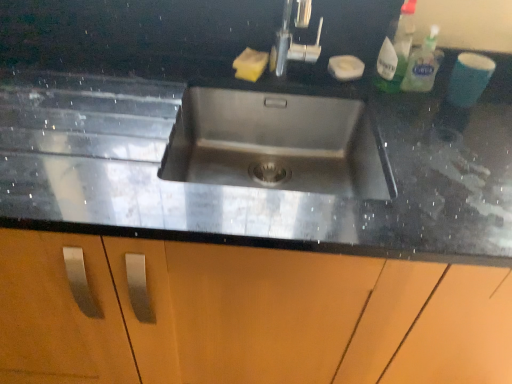
What do you see at coordinates (423, 65) in the screenshot? I see `clear plastic bottle at upper right, marked as the 1th cleaning product in a right-to-left arrangement` at bounding box center [423, 65].

What do you see at coordinates (345, 67) in the screenshot? I see `white matte soap at upper right, which is the first soap in right-to-left order` at bounding box center [345, 67].

What is the approximate width of yellow sponge at upper center, which ranks as the first soap in left-to-right order?

The width of yellow sponge at upper center, which ranks as the first soap in left-to-right order, is 3.96 inches.

Where is `translucent plastic spray bottle at upper right, acting as the 2th cleaning product starting from the right`? This screenshot has height=384, width=512. translucent plastic spray bottle at upper right, acting as the 2th cleaning product starting from the right is located at coordinates (396, 50).

Is translucent plastic spray bottle at upper right, acting as the 2th cleaning product starting from the right, bigger than white matte soap at upper right, which is the 2th soap from left to right?

Yes, translucent plastic spray bottle at upper right, acting as the 2th cleaning product starting from the right, is bigger than white matte soap at upper right, which is the 2th soap from left to right.

From a real-world perspective, is translucent plastic spray bottle at upper right, acting as the 2th cleaning product starting from the right, under white matte soap at upper right, which is the first soap in right-to-left order?

Incorrect, from a real-world perspective, translucent plastic spray bottle at upper right, acting as the 2th cleaning product starting from the right, is higher than white matte soap at upper right, which is the first soap in right-to-left order.

From a real-world perspective, count 2nd cleaning products upward from the white matte soap at upper right, which is the 2th soap from left to right, and point to it. Please provide its 2D coordinates.

[(396, 50)]

Would you say yellow sponge at upper center, acting as the second soap starting from the right, contains translucent plastic spray bottle at upper right, which appears as the 1th cleaning product when viewed from the left?

No, translucent plastic spray bottle at upper right, which appears as the 1th cleaning product when viewed from the left, is not a part of yellow sponge at upper center, acting as the second soap starting from the right.

Is yellow sponge at upper center, which ranks as the first soap in left-to-right order, bigger or smaller than translucent plastic spray bottle at upper right, which appears as the 1th cleaning product when viewed from the left?

Clearly, yellow sponge at upper center, which ranks as the first soap in left-to-right order, is smaller in size than translucent plastic spray bottle at upper right, which appears as the 1th cleaning product when viewed from the left.

Is yellow sponge at upper center, acting as the second soap starting from the right, wider than translucent plastic spray bottle at upper right, which appears as the 1th cleaning product when viewed from the left?

Yes, yellow sponge at upper center, acting as the second soap starting from the right, is wider than translucent plastic spray bottle at upper right, which appears as the 1th cleaning product when viewed from the left.

Is yellow sponge at upper center, which ranks as the first soap in left-to-right order, taller than black granite sink at center?

No.

From the image's perspective, which object appears higher, yellow sponge at upper center, which ranks as the first soap in left-to-right order, or black granite sink at center?

From the image's view, yellow sponge at upper center, which ranks as the first soap in left-to-right order, is above.

Where is `countertop below the yellow sponge at upper center, which ranks as the first soap in left-to-right order (from the image's perspective)`? This screenshot has width=512, height=384. countertop below the yellow sponge at upper center, which ranks as the first soap in left-to-right order (from the image's perspective) is located at coordinates point(219,186).

Is yellow sponge at upper center, acting as the second soap starting from the right, located outside black granite sink at center?

Yes, yellow sponge at upper center, acting as the second soap starting from the right, is outside of black granite sink at center.

In the scene shown: Could you measure the distance between clear plastic bottle at upper right, marked as the 1th cleaning product in a right-to-left arrangement, and white matte soap at upper right, which is the first soap in right-to-left order?

The distance of clear plastic bottle at upper right, marked as the 1th cleaning product in a right-to-left arrangement, from white matte soap at upper right, which is the first soap in right-to-left order, is 5.78 inches.

From the image's perspective, is clear plastic bottle at upper right, the 2th cleaning product positioned from the left, over white matte soap at upper right, which is the first soap in right-to-left order?

No, from the image's perspective, clear plastic bottle at upper right, the 2th cleaning product positioned from the left, is not on top of white matte soap at upper right, which is the first soap in right-to-left order.

Which object is further away from the camera, clear plastic bottle at upper right, marked as the 1th cleaning product in a right-to-left arrangement, or white matte soap at upper right, which is the first soap in right-to-left order?

white matte soap at upper right, which is the first soap in right-to-left order, is behind.

Is clear plastic bottle at upper right, the 2th cleaning product positioned from the left, bigger or smaller than white matte soap at upper right, which is the first soap in right-to-left order?

clear plastic bottle at upper right, the 2th cleaning product positioned from the left, is bigger than white matte soap at upper right, which is the first soap in right-to-left order.

Considering the positions of objects black granite sink at center and white matte soap at upper right, which is the first soap in right-to-left order, in the image provided, who is behind, black granite sink at center or white matte soap at upper right, which is the first soap in right-to-left order,?

white matte soap at upper right, which is the first soap in right-to-left order, is behind.

What's the angular difference between black granite sink at center and white matte soap at upper right, which is the first soap in right-to-left order,'s facing directions?

The angle between the facing direction of black granite sink at center and the facing direction of white matte soap at upper right, which is the first soap in right-to-left order, is 21.9 degrees.

Does black granite sink at center have a greater width compared to white matte soap at upper right, which is the first soap in right-to-left order?

Yes, black granite sink at center is wider than white matte soap at upper right, which is the first soap in right-to-left order.

Which object is positioned more to the right, black granite sink at center or white matte soap at upper right, which is the first soap in right-to-left order?

white matte soap at upper right, which is the first soap in right-to-left order, is more to the right.

Does white matte soap at upper right, which is the 2th soap from left to right, have a smaller size compared to yellow sponge at upper center, which ranks as the first soap in left-to-right order?

Incorrect, white matte soap at upper right, which is the 2th soap from left to right, is not smaller in size than yellow sponge at upper center, which ranks as the first soap in left-to-right order.

Are white matte soap at upper right, which is the first soap in right-to-left order, and yellow sponge at upper center, acting as the second soap starting from the right, located far from each other?

No.

Who is shorter, white matte soap at upper right, which is the first soap in right-to-left order, or yellow sponge at upper center, which ranks as the first soap in left-to-right order?

Standing shorter between the two is yellow sponge at upper center, which ranks as the first soap in left-to-right order.

Consider the image. Could you tell me if white matte soap at upper right, which is the 2th soap from left to right, is facing yellow sponge at upper center, which ranks as the first soap in left-to-right order?

No, white matte soap at upper right, which is the 2th soap from left to right, is not turned towards yellow sponge at upper center, which ranks as the first soap in left-to-right order.

From the image's perspective, who appears lower, white matte soap at upper right, which is the first soap in right-to-left order, or translucent plastic spray bottle at upper right, acting as the 2th cleaning product starting from the right?

white matte soap at upper right, which is the first soap in right-to-left order, from the image's perspective.

From a real-world perspective, is white matte soap at upper right, which is the 2th soap from left to right, over translucent plastic spray bottle at upper right, which appears as the 1th cleaning product when viewed from the left?

No.

Does point (337, 75) appear closer or farther from the camera than point (396, 52)?

Clearly, point (337, 75) is more distant from the camera than point (396, 52).

From the white matte soap at upper right, which is the 2th soap from left to right, count 1st cleaning product to the right and point to it. Please provide its 2D coordinates.

[(396, 50)]

Locate an element on the screen. Image resolution: width=512 pixels, height=384 pixels. the 1st soap to the left when counting from the translucent plastic spray bottle at upper right, which appears as the 1th cleaning product when viewed from the left is located at coordinates (345, 67).

This screenshot has height=384, width=512. I want to click on the 2nd cleaning product in front of the yellow sponge at upper center, which ranks as the first soap in left-to-right order, so click(396, 50).

Considering their positions, is clear plastic bottle at upper right, marked as the 1th cleaning product in a right-to-left arrangement, positioned further to yellow sponge at upper center, acting as the second soap starting from the right, than translucent plastic spray bottle at upper right, which appears as the 1th cleaning product when viewed from the left?

clear plastic bottle at upper right, marked as the 1th cleaning product in a right-to-left arrangement, lies further to yellow sponge at upper center, acting as the second soap starting from the right, than the other object.

Based on their spatial positions, is translucent plastic spray bottle at upper right, acting as the 2th cleaning product starting from the right, or white matte soap at upper right, which is the 2th soap from left to right, closer to yellow sponge at upper center, which ranks as the first soap in left-to-right order?

white matte soap at upper right, which is the 2th soap from left to right.

When comparing their distances from black granite sink at center, does clear plastic bottle at upper right, the 2th cleaning product positioned from the left, or white matte soap at upper right, which is the 2th soap from left to right, seem closer?

The object closer to black granite sink at center is white matte soap at upper right, which is the 2th soap from left to right.

Based on their spatial positions, is yellow sponge at upper center, acting as the second soap starting from the right, or clear plastic bottle at upper right, marked as the 1th cleaning product in a right-to-left arrangement, closer to white matte soap at upper right, which is the first soap in right-to-left order?

Based on the image, clear plastic bottle at upper right, marked as the 1th cleaning product in a right-to-left arrangement, appears to be nearer to white matte soap at upper right, which is the first soap in right-to-left order.

Based on the photo, estimate the real-world distances between objects in this image. Which object is further from black granite sink at center, yellow sponge at upper center, which ranks as the first soap in left-to-right order, or translucent plastic spray bottle at upper right, acting as the 2th cleaning product starting from the right?

translucent plastic spray bottle at upper right, acting as the 2th cleaning product starting from the right, is positioned further to the anchor black granite sink at center.

Estimate the real-world distances between objects in this image. Which object is closer to black granite sink at center, white matte soap at upper right, which is the first soap in right-to-left order, or yellow sponge at upper center, which ranks as the first soap in left-to-right order?

Among the two, yellow sponge at upper center, which ranks as the first soap in left-to-right order, is located nearer to black granite sink at center.

Looking at the image, which one is located closer to clear plastic bottle at upper right, marked as the 1th cleaning product in a right-to-left arrangement, white matte soap at upper right, which is the first soap in right-to-left order, or translucent plastic spray bottle at upper right, acting as the 2th cleaning product starting from the right?

Among the two, translucent plastic spray bottle at upper right, acting as the 2th cleaning product starting from the right, is located nearer to clear plastic bottle at upper right, marked as the 1th cleaning product in a right-to-left arrangement.

When comparing their distances from white matte soap at upper right, which is the 2th soap from left to right, does yellow sponge at upper center, which ranks as the first soap in left-to-right order, or black granite sink at center seem further?

black granite sink at center lies further to white matte soap at upper right, which is the 2th soap from left to right, than the other object.

Identify the location of cleaning product between translucent plastic spray bottle at upper right, which appears as the 1th cleaning product when viewed from the left, and black granite sink at center from top to bottom. Image resolution: width=512 pixels, height=384 pixels. (423, 65).

At what (x,y) coordinates should I click in order to perform the action: click on cleaning product between white matte soap at upper right, which is the 2th soap from left to right, and black granite sink at center in the up-down direction. Please return your answer as a coordinate pair (x, y). Looking at the image, I should click on (423, 65).

Image resolution: width=512 pixels, height=384 pixels. Identify the location of soap situated between yellow sponge at upper center, which ranks as the first soap in left-to-right order, and clear plastic bottle at upper right, marked as the 1th cleaning product in a right-to-left arrangement, from left to right. (345, 67).

This screenshot has width=512, height=384. I want to click on soap between yellow sponge at upper center, which ranks as the first soap in left-to-right order, and black granite sink at center vertically, so click(345, 67).